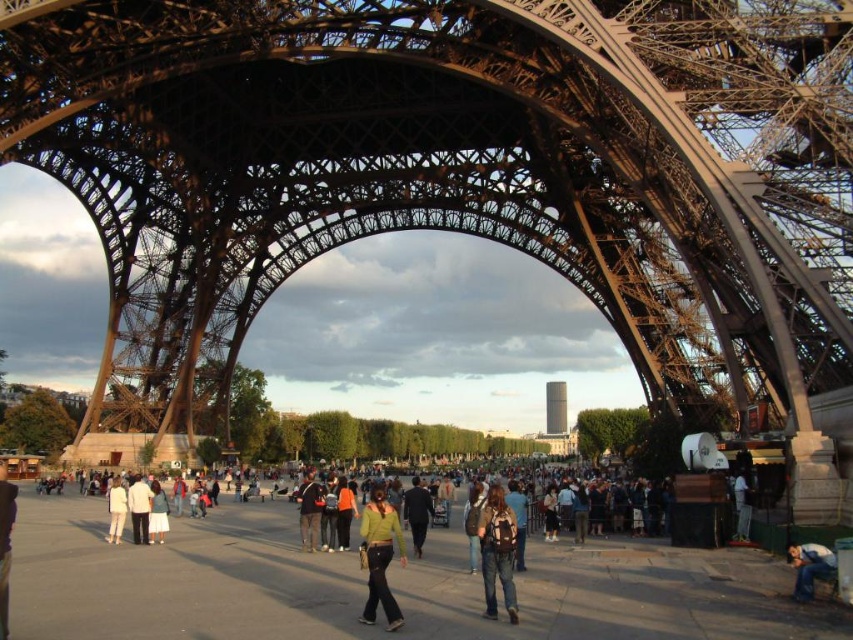
You are standing at the base of the Eiffel Tower and see the smooth glass tower at center and the white fabric shirt at lower right. Which object is closer to you?

The smooth glass tower at center is closer to you than the white fabric shirt at lower right because the shirt is positioned behind the tower.

You are a photographer standing at the base of the Eiffel Tower. You want to capture both the black matte suit at center and the light blue denim jeans at center in the same frame. Given that your camera has a 50mm lens, which has a field of view of approximately 46 degrees, can you fit both subjects into the frame without moving closer or further away?

The black matte suit at center and light blue denim jeans at center are 37.47 meters apart. With a 50mm lens providing a 46 degree field of view, the maximum distance between two points that can be captured in the frame would be calculated using trigonometry. However, at 37.47 meters apart, this distance far exceeds the lens capabilities, so it would not be possible to capture both in the same frame without moving closer.